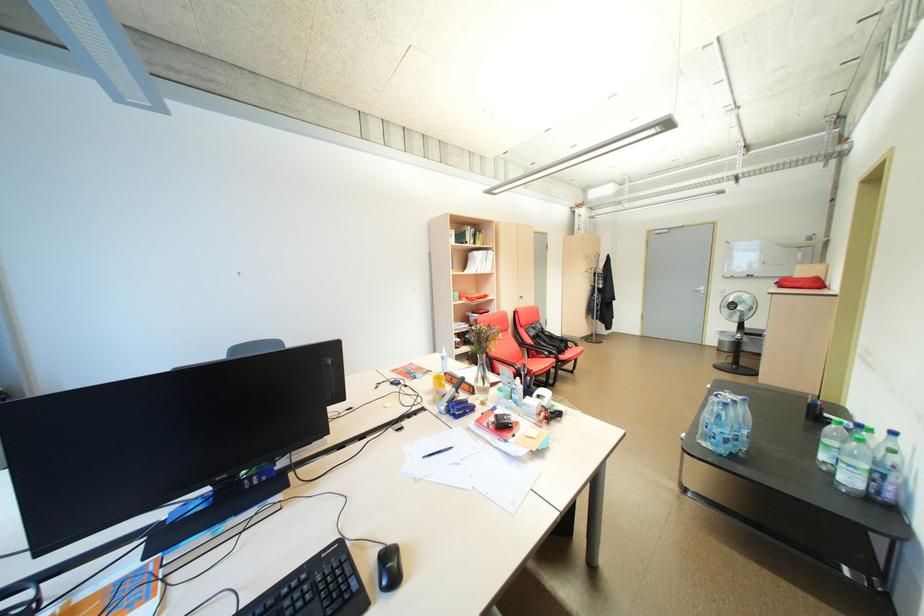
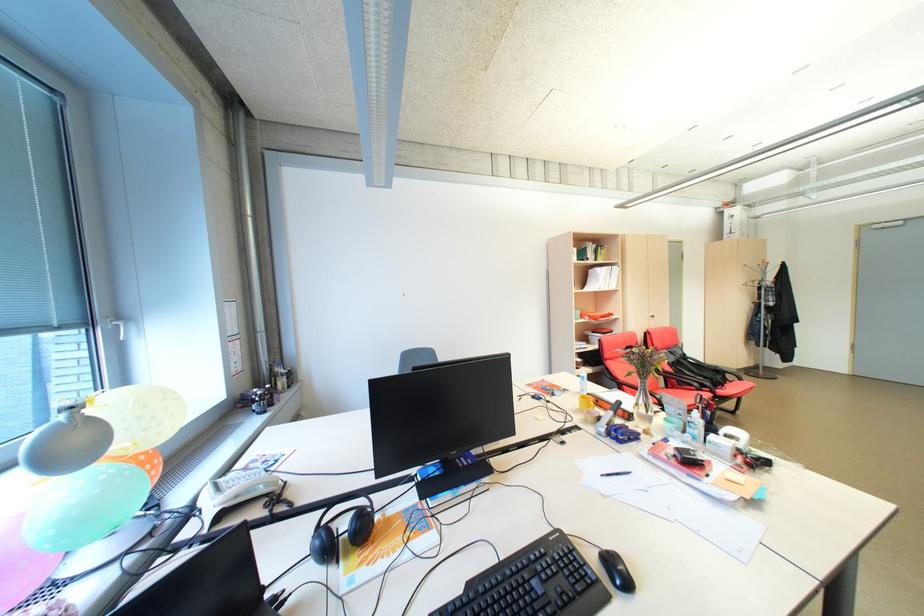
In the second image, find the point that corresponds to point 517,379 in the first image.

(688, 410)